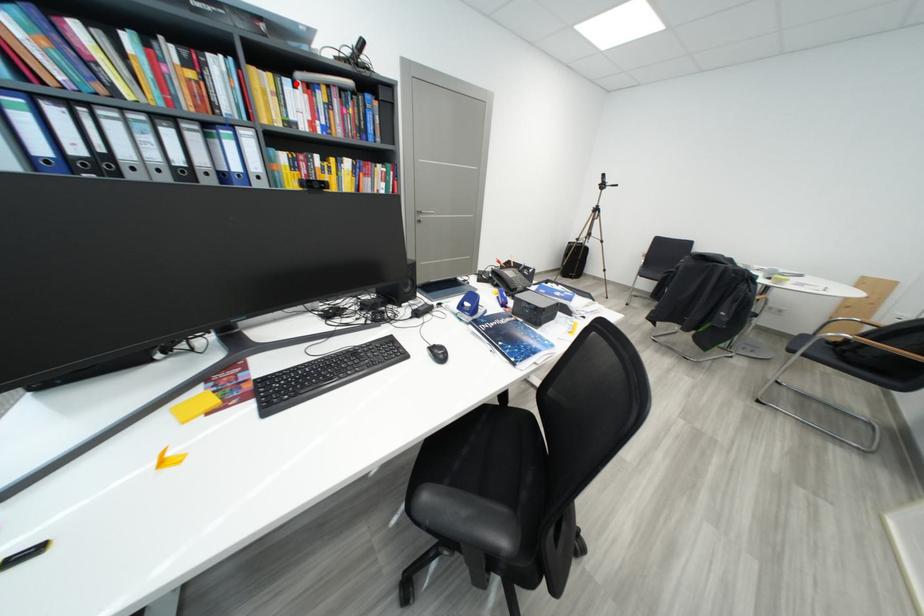
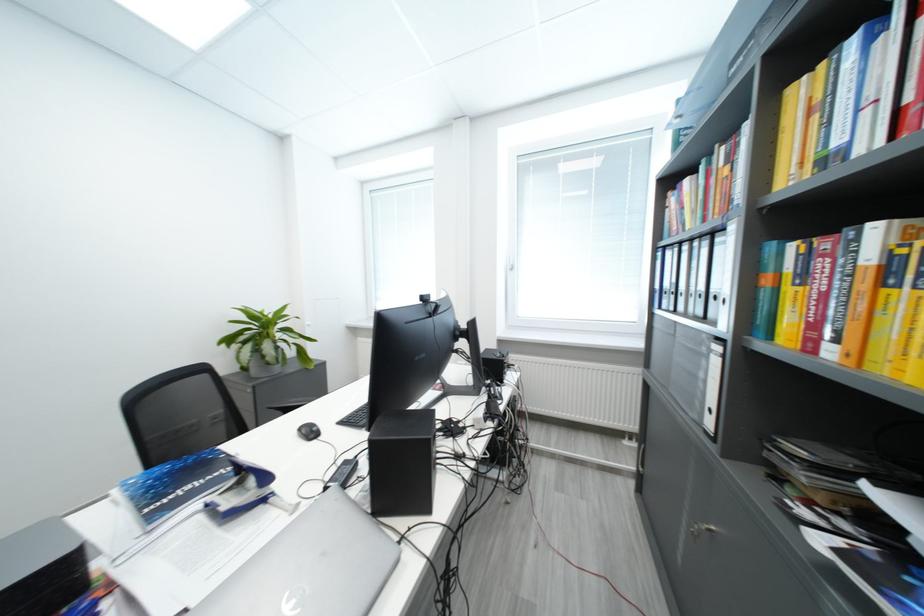
Locate, in the second image, the point that corresponds to the highlighted location in the first image.

(861, 44)